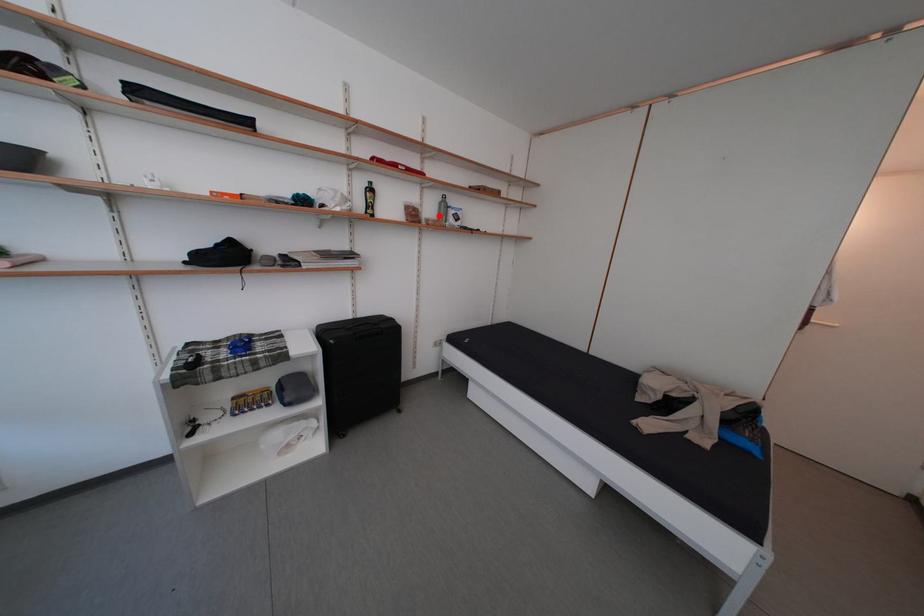
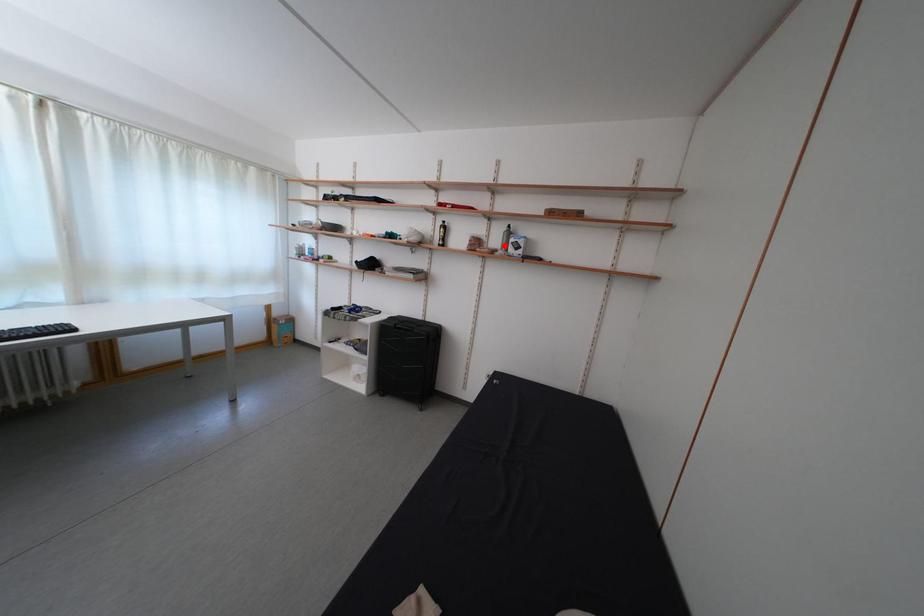
I am providing you with two images of the same scene from different viewpoints. A red point is marked on the first image and another point is marked on the second image. Does the point marked in image1 correspond to the same location as the one in image2?

Yes